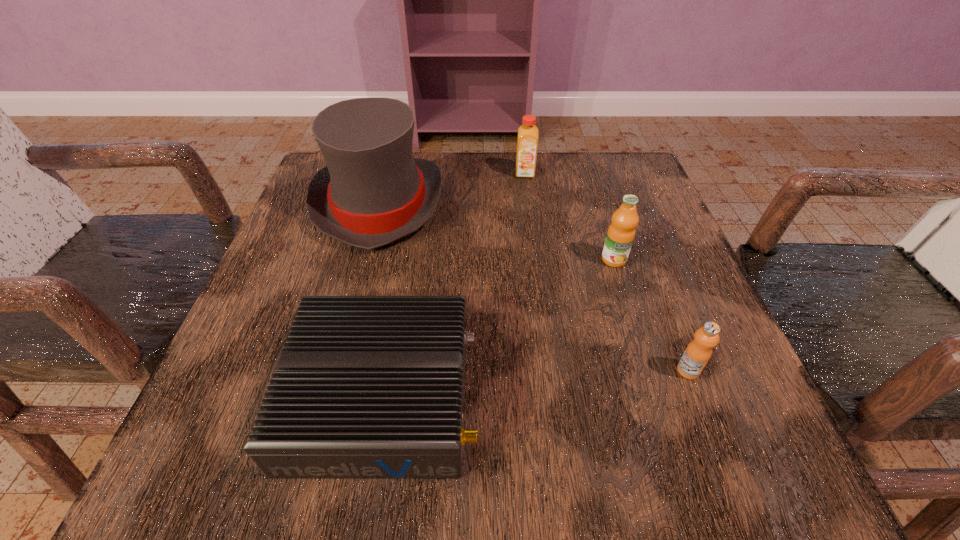
The width and height of the screenshot is (960, 540). I want to click on the tallest object, so click(x=372, y=192).

Locate an element on the screen. This screenshot has height=540, width=960. the second object from right to left is located at coordinates tap(621, 232).

Where is `the second orange juice from right to left`? This screenshot has height=540, width=960. the second orange juice from right to left is located at coordinates (621, 232).

At what (x,y) coordinates should I click in order to perform the action: click on the farthest orange juice. Please return your answer as a coordinate pair (x, y). Looking at the image, I should click on (527, 143).

Identify the location of the third object from left to right. (527, 143).

Where is `the rightmost object`? The height and width of the screenshot is (540, 960). the rightmost object is located at coordinates (698, 352).

The height and width of the screenshot is (540, 960). In order to click on the shortest orange juice in this screenshot , I will do pos(698,352).

Where is `the shortest object`? the shortest object is located at coordinates (365, 386).

The height and width of the screenshot is (540, 960). I want to click on vacant space located on the right of the dress hat, so click(x=576, y=204).

In order to click on free space located 0.050m on the label of the second farthest orange juice in this screenshot , I will do `click(623, 288)`.